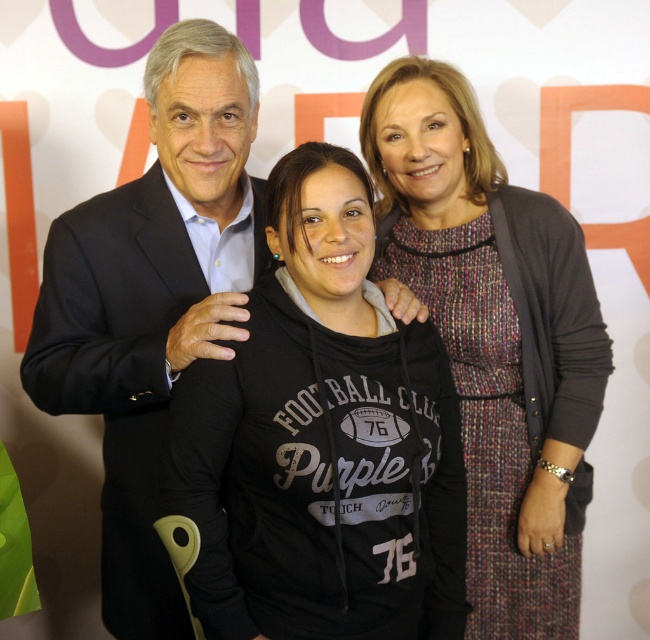
You are standing at the point labeled point (333, 604) and want to take a photo of the scene. The camera is 3.71 feet away from you. Is the camera within a 4 feet distance range to capture a clear photo?

The camera is 3.71 feet away from point (333, 604), which is within the 4 feet distance range, so yes, the camera is close enough to capture a clear photo.

You are a photographer trying to adjust the lighting for the photo. You notice two clothing items at the center of the image. Which clothing item is smaller in size between the black hoodie at center and the knitted sweater at center?

The black hoodie at center is smaller in size compared to the knitted sweater at center.